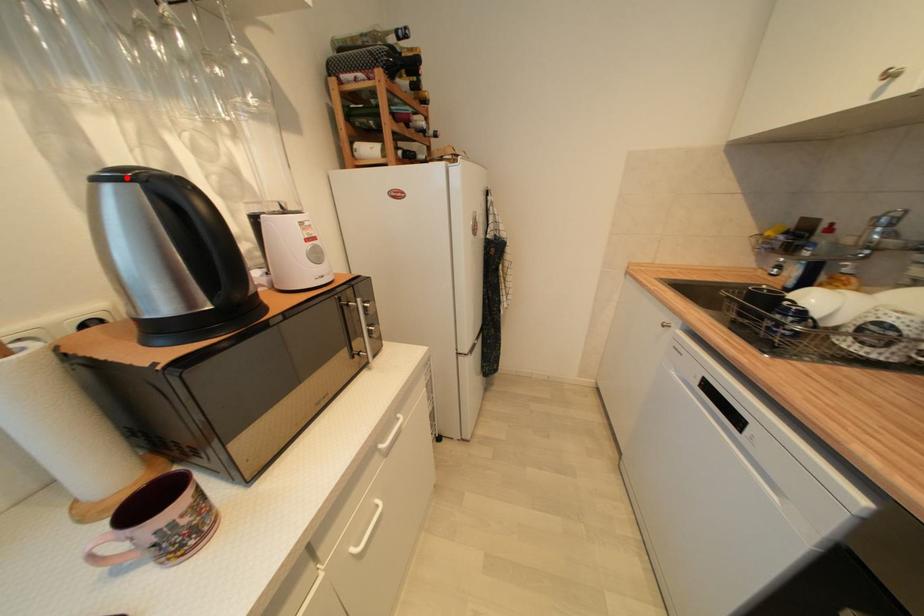
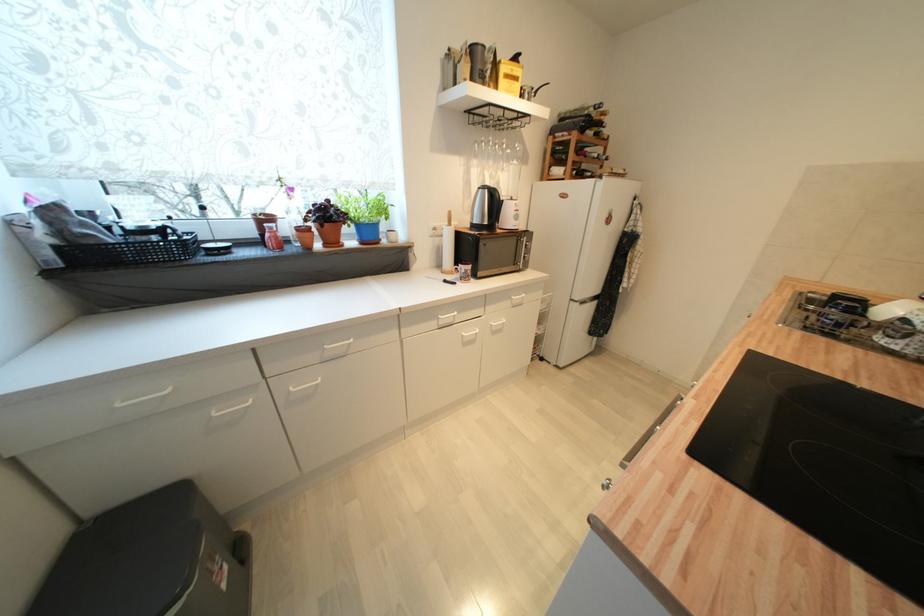
Where in the second image is the point corresponding to the highlighted location from the first image?

(489, 188)